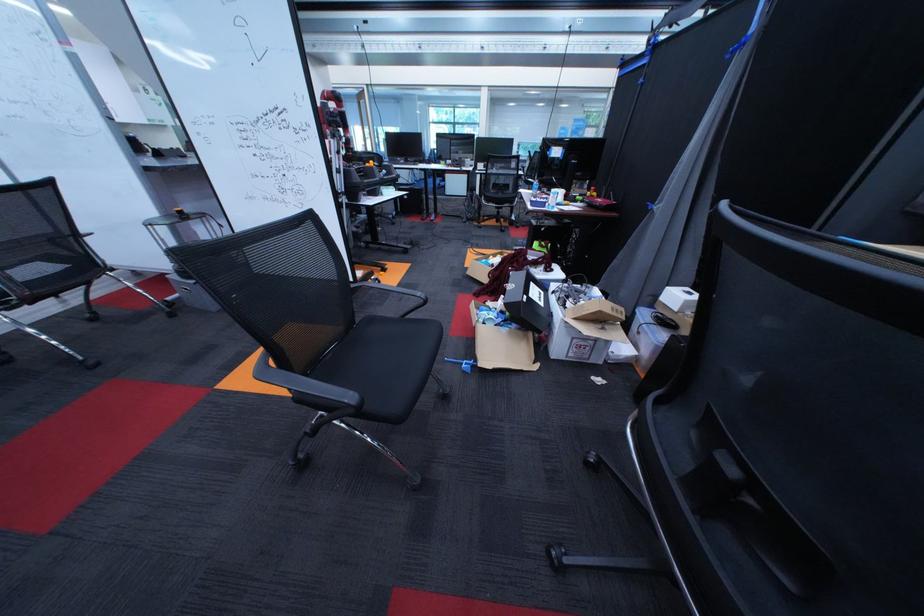
Identify the location of chair sitting surface. The image size is (924, 616). (381, 354).